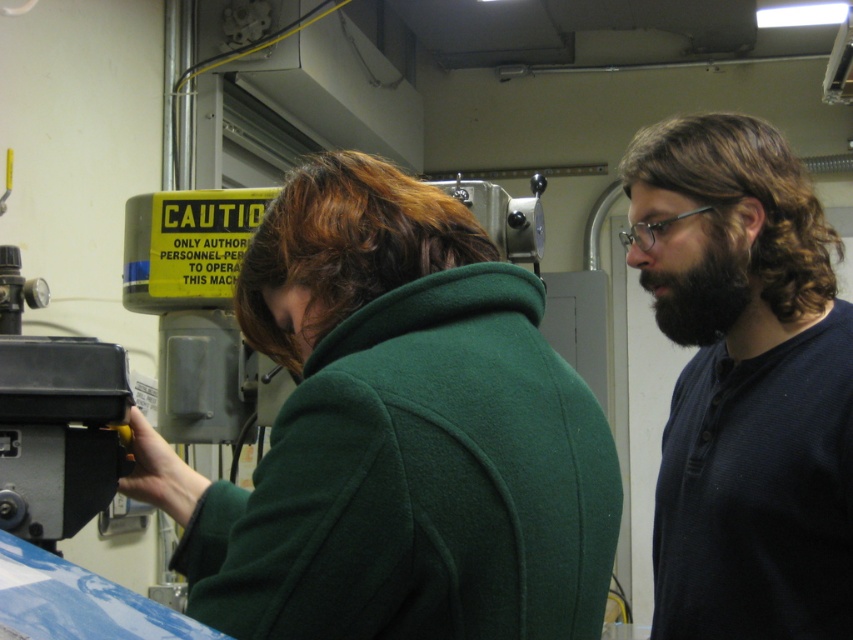
Question: Which object appears closest to the camera in this image?

Choices:
 (A) dark blue knit sweater at right
 (B) black fuzzy beard at right

Answer: (A)

Question: Does dark blue knit sweater at right lie behind black fuzzy beard at right?

Choices:
 (A) no
 (B) yes

Answer: (A)

Question: Can you confirm if dark blue knit sweater at right is positioned above black fuzzy beard at right?

Choices:
 (A) yes
 (B) no

Answer: (B)

Question: Considering the real-world distances, which object is closest to the dark blue knit sweater at right?

Choices:
 (A) black fuzzy beard at right
 (B) green woolen coat at center

Answer: (A)

Question: Does green woolen coat at center lie in front of black fuzzy beard at right?

Choices:
 (A) yes
 (B) no

Answer: (A)

Question: Estimate the real-world distances between objects in this image. Which object is closer to the green woolen coat at center?

Choices:
 (A) dark blue knit sweater at right
 (B) black fuzzy beard at right

Answer: (A)